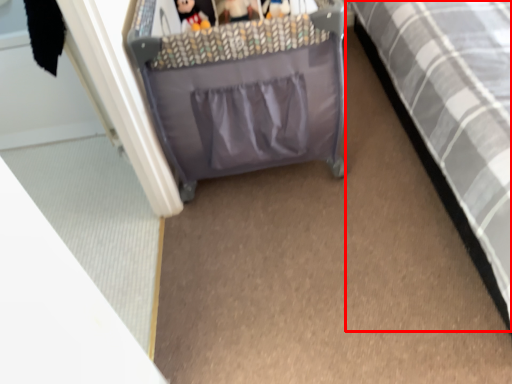
Question: Observing the image, what is the correct spatial positioning of furniture (annotated by the red box) in reference to toy?

Choices:
 (A) right
 (B) left

Answer: (A)